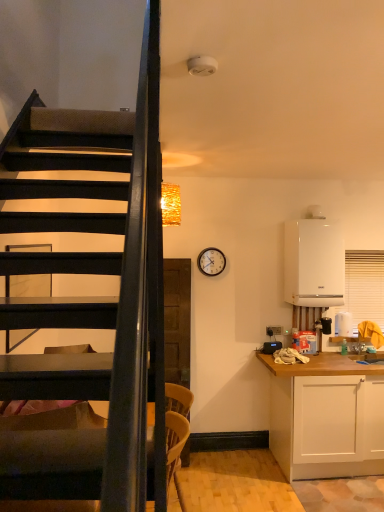
Question: Is light brown woven chair at lower center wider or thinner than white matte cabinet at lower right?

Choices:
 (A) wide
 (B) thin

Answer: (B)

Question: From a real-world perspective, is light brown woven chair at lower center above or below white matte cabinet at lower right?

Choices:
 (A) above
 (B) below

Answer: (A)

Question: Based on their relative distances, which object is farther from the light brown woven chair at lower center?

Choices:
 (A) wooden clock at upper center
 (B) white blinds at right
 (C) white matte cabinet at lower right
 (D) white glossy boiler at right

Answer: (B)

Question: Considering the real-world distances, which object is farthest from the white matte cabinet at lower right?

Choices:
 (A) white glossy boiler at right
 (B) light brown woven chair at lower center
 (C) white blinds at right
 (D) wooden clock at upper center

Answer: (D)